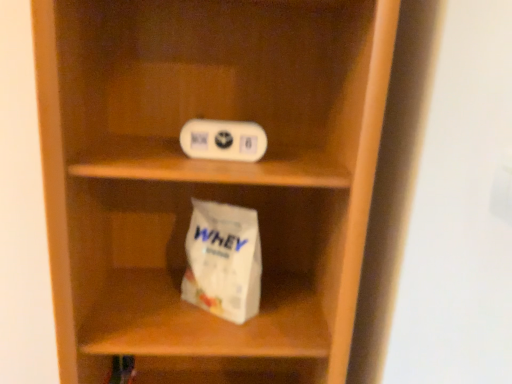
Question: Is white matte paper bag at lower center turned away from wooden shelf at center?

Choices:
 (A) yes
 (B) no

Answer: (A)

Question: From a real-world perspective, is white matte paper bag at lower center below wooden shelf at center?

Choices:
 (A) no
 (B) yes

Answer: (B)

Question: From the image's perspective, would you say white matte paper bag at lower center is shown under wooden shelf at center?

Choices:
 (A) no
 (B) yes

Answer: (B)

Question: Is white matte paper bag at lower center to the right of wooden shelf at center from the viewer's perspective?

Choices:
 (A) yes
 (B) no

Answer: (A)

Question: Is white matte paper bag at lower center smaller than wooden shelf at center?

Choices:
 (A) yes
 (B) no

Answer: (A)

Question: Does white matte paper bag at lower center have a larger size compared to wooden shelf at center?

Choices:
 (A) yes
 (B) no

Answer: (B)

Question: Considering the relative sizes of wooden shelf at center and white plastic ipod at upper center in the image provided, is wooden shelf at center shorter than white plastic ipod at upper center?

Choices:
 (A) yes
 (B) no

Answer: (B)

Question: Is wooden shelf at center smaller than white plastic ipod at upper center?

Choices:
 (A) yes
 (B) no

Answer: (B)

Question: Is wooden shelf at center not inside white plastic ipod at upper center?

Choices:
 (A) no
 (B) yes

Answer: (B)

Question: From the image's perspective, would you say wooden shelf at center is shown under white plastic ipod at upper center?

Choices:
 (A) yes
 (B) no

Answer: (A)

Question: Is wooden shelf at center positioned before white plastic ipod at upper center?

Choices:
 (A) yes
 (B) no

Answer: (A)

Question: Is wooden shelf at center at the right side of white plastic ipod at upper center?

Choices:
 (A) no
 (B) yes

Answer: (A)

Question: Does wooden shelf at center have a greater width compared to white matte paper bag at lower center?

Choices:
 (A) yes
 (B) no

Answer: (A)